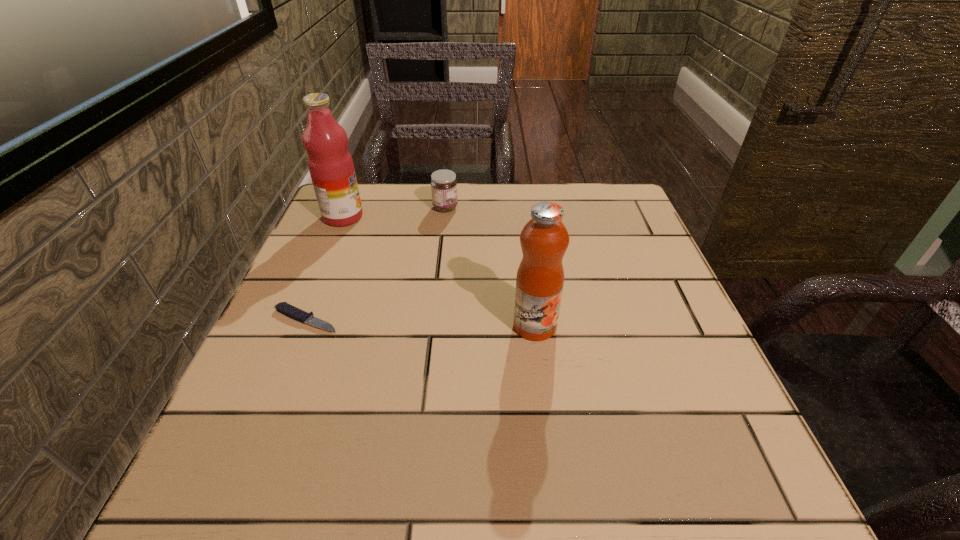
Find the location of a particular element. fruit juice that is at the far edge is located at coordinates (331, 167).

Locate an element on the screen. jam that is at the far edge is located at coordinates (443, 184).

At what (x,y) coordinates should I click in order to perform the action: click on fruit juice located in the left edge section of the desktop. Please return your answer as a coordinate pair (x, y). Looking at the image, I should click on (331, 167).

Find the location of a particular element. Image resolution: width=960 pixels, height=540 pixels. steak knife present at the left edge is located at coordinates (284, 308).

The image size is (960, 540). I want to click on object that is at the far left corner, so click(x=331, y=167).

Identify the location of vacant space at the far edge of the desktop. (412, 202).

At what (x,y) coordinates should I click in order to perform the action: click on vacant space at the near edge. Please return your answer as a coordinate pair (x, y). This screenshot has height=540, width=960. Looking at the image, I should click on (473, 489).

Image resolution: width=960 pixels, height=540 pixels. Find the location of `free spot at the left edge of the desktop`. free spot at the left edge of the desktop is located at coordinates (347, 298).

At what (x,y) coordinates should I click in order to perform the action: click on vacant area at the right edge. Please return your answer as a coordinate pair (x, y). The image size is (960, 540). Looking at the image, I should click on (636, 328).

At what (x,y) coordinates should I click in order to perform the action: click on vacant space at the far left corner. Please return your answer as a coordinate pair (x, y). The height and width of the screenshot is (540, 960). Looking at the image, I should click on pos(368,220).